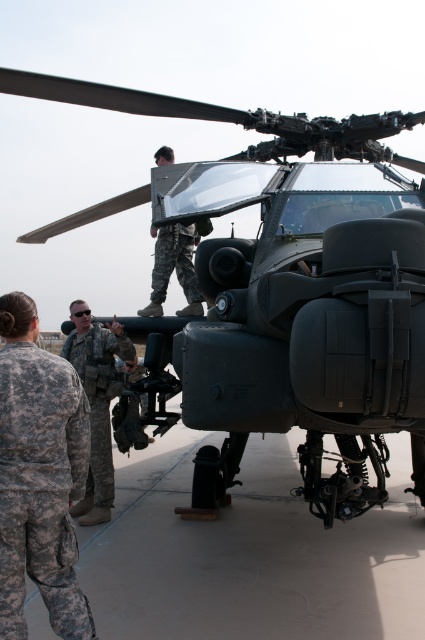
Is camouflage uniform at lower left taller than camouflage fabric uniform at center?

Yes, camouflage uniform at lower left is taller than camouflage fabric uniform at center.

Which is behind, point (81, 369) or point (147, 314)?

The point (147, 314) is more distant.

Is point (87, 506) positioned after point (186, 264)?

No, (87, 506) is in front of (186, 264).

Find the location of a particular element. camouflage uniform at lower left is located at coordinates (96, 403).

Is camouflage fabric uniform at lower left in front of camouflage fabric uniform at center?

That is True.

Which is above, camouflage fabric uniform at lower left or camouflage fabric uniform at center?

camouflage fabric uniform at center is above.

Identify the location of camouflage fabric uniform at lower left. (39, 476).

The image size is (425, 640). I want to click on camouflage fabric uniform at lower left, so click(x=39, y=476).

Who is taller, matte black helicopter at center or camouflage fabric uniform at lower left?

matte black helicopter at center

You are a GUI agent. You are given a task and a screenshot of the screen. Output one action in this format:
    pyautogui.click(x=<x>, y=<y>)
    Task: Click on the matte black helicopter at center
    Image resolution: width=425 pixels, height=640 pixels.
    Given the screenshot: What is the action you would take?
    pyautogui.click(x=285, y=288)

Who is more forward, (193, 323) or (36, 420)?

Point (36, 420)

The image size is (425, 640). I want to click on matte black helicopter at center, so click(285, 288).